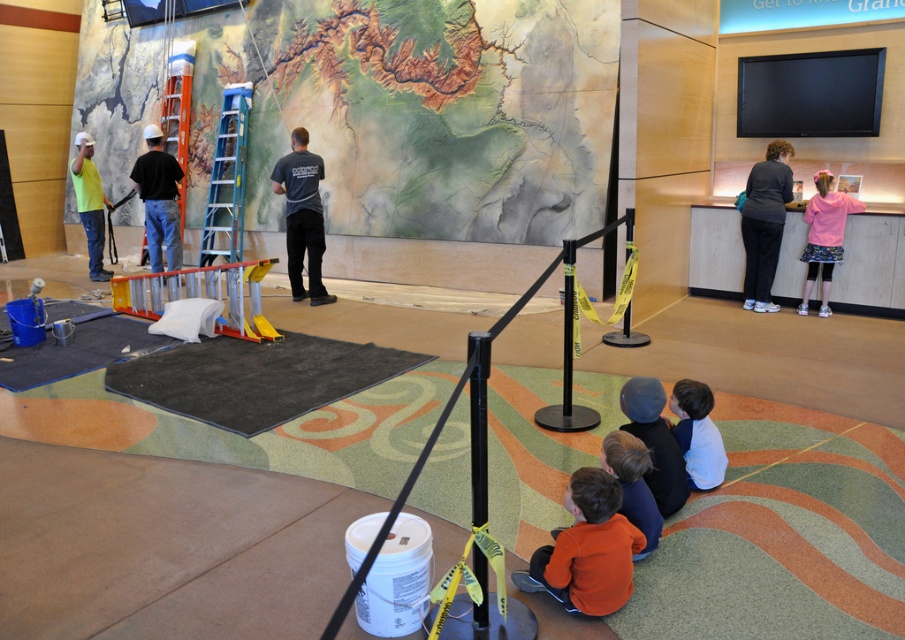
Does orange cotton shirt at lower center appear over matte yellow shirt at left?

No.

Between orange cotton shirt at lower center and matte yellow shirt at left, which one appears on the left side from the viewer's perspective?

Positioned to the left is matte yellow shirt at left.

Which is in front, point (644, 468) or point (105, 202)?

Point (644, 468)

The height and width of the screenshot is (640, 905). Find the location of `orange cotton shirt at lower center`. orange cotton shirt at lower center is located at coordinates (632, 483).

Can you confirm if pink fleece jacket at upper right is smaller than orange cotton shirt at lower center?

No, pink fleece jacket at upper right is not smaller than orange cotton shirt at lower center.

Consider the image. Who is positioned more to the right, pink fleece jacket at upper right or orange cotton shirt at lower center?

pink fleece jacket at upper right is more to the right.

Describe the element at coordinates (824, 236) in the screenshot. I see `pink fleece jacket at upper right` at that location.

You are a GUI agent. You are given a task and a screenshot of the screen. Output one action in this format:
    pyautogui.click(x=<x>, y=<y>)
    Task: Click on the pink fleece jacket at upper right
    
    Given the screenshot: What is the action you would take?
    pyautogui.click(x=824, y=236)

Who is higher up, white cotton shirt at lower right or matte yellow shirt at left?

matte yellow shirt at left is above.

What do you see at coordinates (697, 433) in the screenshot?
I see `white cotton shirt at lower right` at bounding box center [697, 433].

The height and width of the screenshot is (640, 905). I want to click on white cotton shirt at lower right, so click(697, 433).